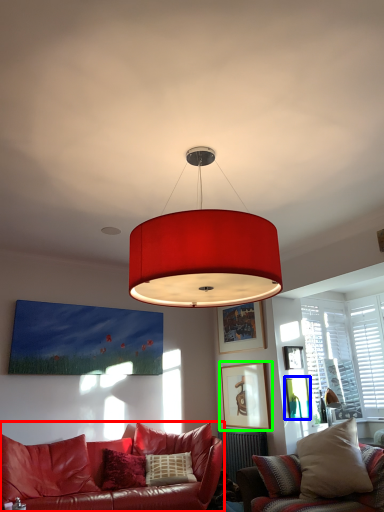
Question: Considering the real-world distances, which object is closest to studio couch (highlighted by a red box)? picture frame (highlighted by a blue box) or picture frame (highlighted by a green box).

Choices:
 (A) picture frame
 (B) picture frame

Answer: (B)